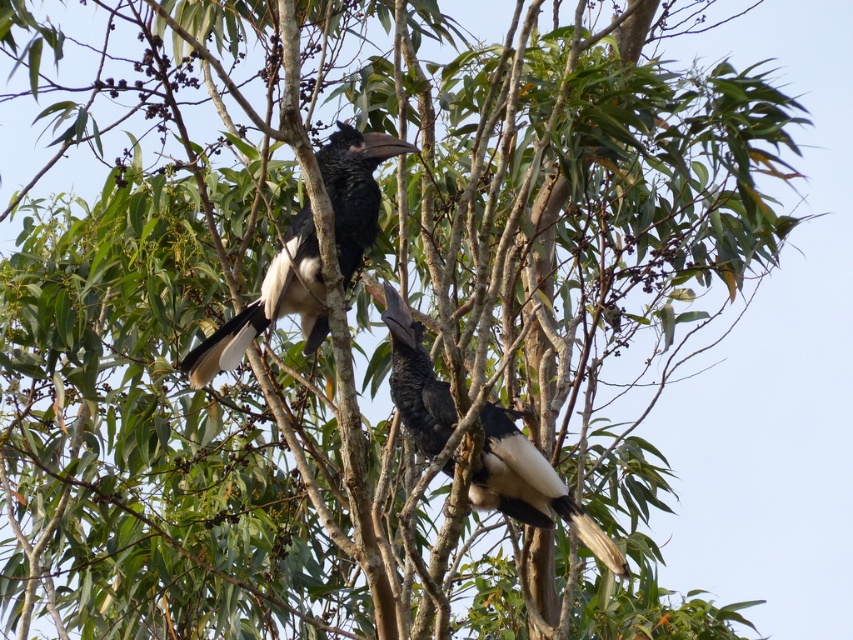
Can you confirm if black glossy hornbill at center is taller than black matte hornbill at center?

No.

The width and height of the screenshot is (853, 640). What are the coordinates of `black glossy hornbill at center` in the screenshot? It's located at (270, 305).

Find the location of `black glossy hornbill at center`. black glossy hornbill at center is located at coordinates (270, 305).